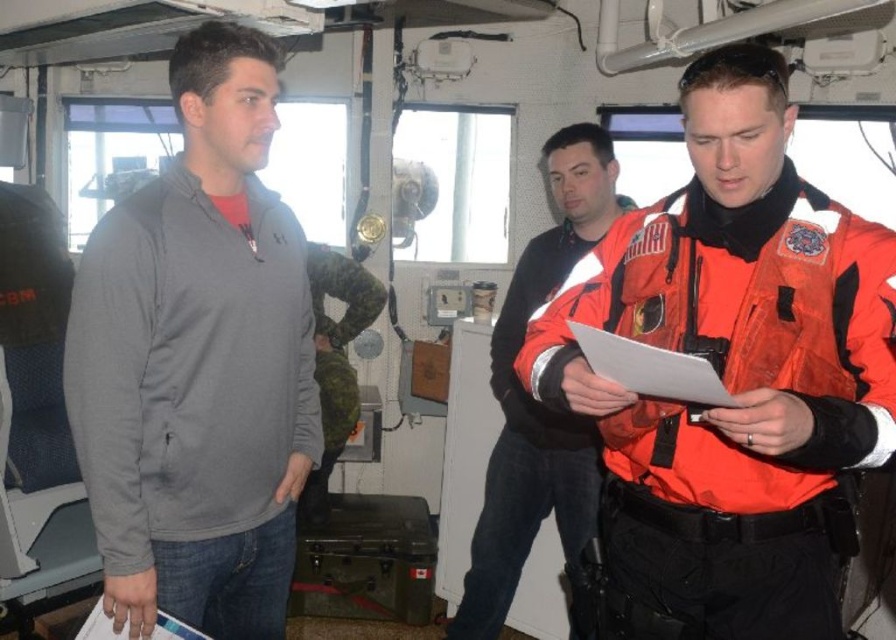
Question: Is orange reflective jacket at center in front of camouflage fabric uniform at center?

Choices:
 (A) yes
 (B) no

Answer: (A)

Question: Which of the following is the farthest from the observer?

Choices:
 (A) (579, 483)
 (B) (313, 493)

Answer: (B)

Question: Which of these objects is positioned closest to the gray fleece jacket at left?

Choices:
 (A) orange reflective jacket at center
 (B) camouflage fabric uniform at center
 (C) orange fabric life jacket at center

Answer: (C)

Question: Does orange fabric life jacket at center have a lesser width compared to orange reflective jacket at center?

Choices:
 (A) yes
 (B) no

Answer: (A)

Question: Which object is closer to the camera taking this photo?

Choices:
 (A) camouflage fabric uniform at center
 (B) orange reflective jacket at center

Answer: (B)

Question: Observing the image, what is the correct spatial positioning of gray fleece jacket at left in reference to orange fabric life jacket at center?

Choices:
 (A) left
 (B) right

Answer: (A)